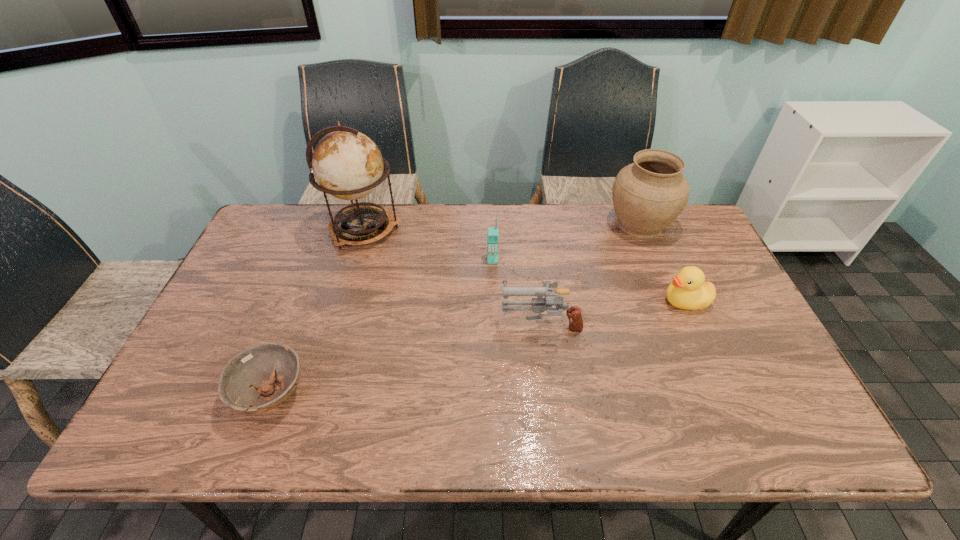
Where is `globe`? Image resolution: width=960 pixels, height=540 pixels. globe is located at coordinates (347, 164).

The height and width of the screenshot is (540, 960). I want to click on urn, so click(649, 194).

At what (x,y) coordinates should I click in order to perform the action: click on the third object from left to right. Please return your answer as a coordinate pair (x, y). This screenshot has height=540, width=960. Looking at the image, I should click on (492, 232).

Identify the location of the third farthest object. This screenshot has height=540, width=960. (492, 232).

Locate an element on the screen. Image resolution: width=960 pixels, height=540 pixels. the third object from right to left is located at coordinates (539, 305).

Locate an element on the screen. The image size is (960, 540). duck is located at coordinates (689, 290).

Where is `the nearest object`? the nearest object is located at coordinates [252, 372].

The image size is (960, 540). What are the coordinates of `the shortest object` in the screenshot? It's located at (252, 372).

Locate an element on the screen. blank area located 0.060m at the center of the tallest object is located at coordinates (420, 230).

The width and height of the screenshot is (960, 540). I want to click on vacant space located on the right of the second tallest object, so click(x=695, y=224).